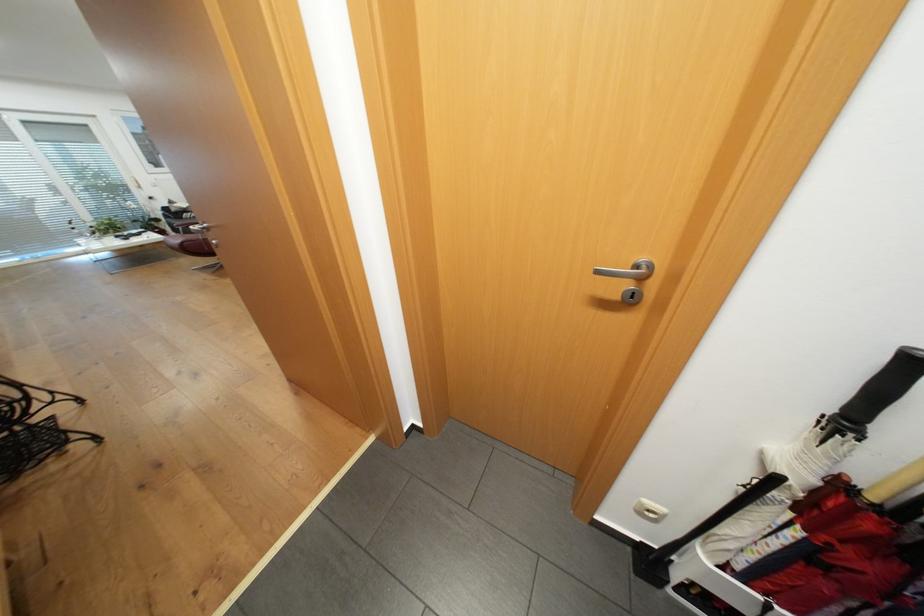
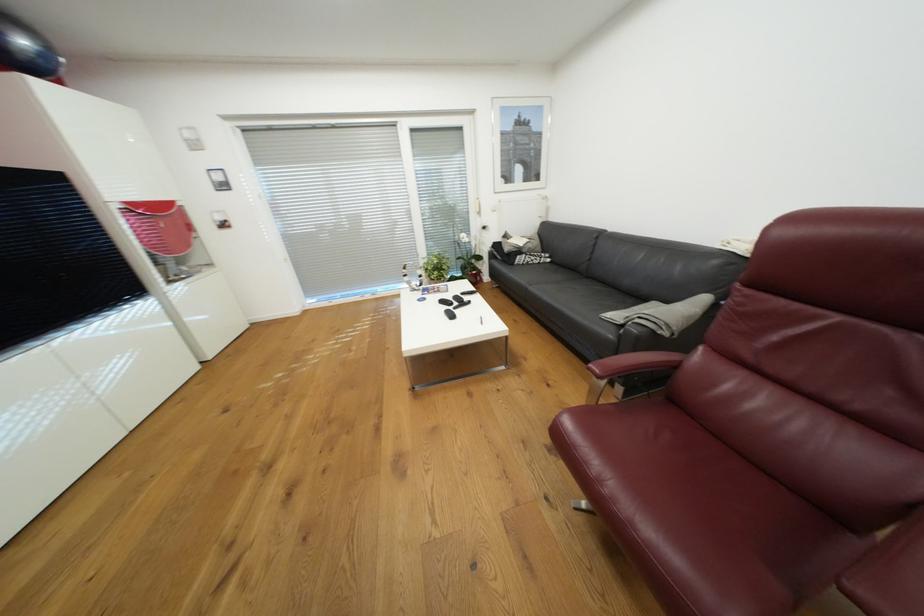
Locate, in the second image, the point that corresponds to [191,211] in the first image.

(526, 252)